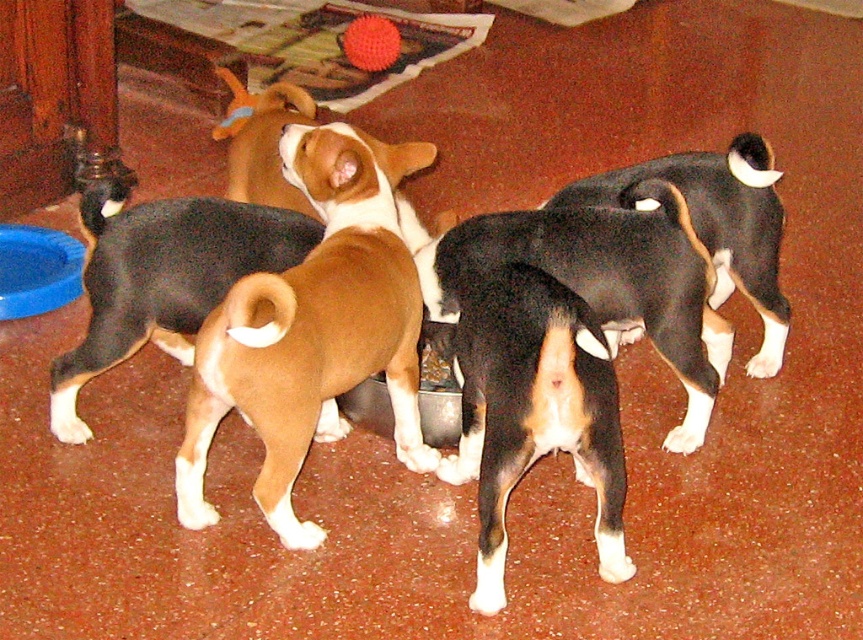
How distant is brown and white fur at center from brown fur at center?

brown and white fur at center and brown fur at center are 32.82 inches apart from each other.

Is point (206, 244) closer to viewer compared to point (301, 246)?

Yes, it is.

Which is in front, point (244, 189) or point (184, 340)?

Point (184, 340) is more forward.

Where is `brown and white fur at center`? The height and width of the screenshot is (640, 863). brown and white fur at center is located at coordinates (181, 256).

Does brown and white fur at center have a larger size compared to brown matte dog at center?

No.

Is brown and white fur at center positioned behind brown matte dog at center?

Yes.

Is point (282, 221) closer to viewer compared to point (387, 237)?

No, (282, 221) is further to viewer.

At what (x,y) coordinates should I click in order to perform the action: click on brown and white fur at center. Please return your answer as a coordinate pair (x, y). Looking at the image, I should click on click(181, 256).

What do you see at coordinates (162, 276) in the screenshot?
I see `brown fur at center` at bounding box center [162, 276].

Is brown fur at center positioned before rubber toy at upper center?

Yes, it is.

Describe the element at coordinates (162, 276) in the screenshot. I see `brown fur at center` at that location.

Identify the location of brown fur at center. (162, 276).